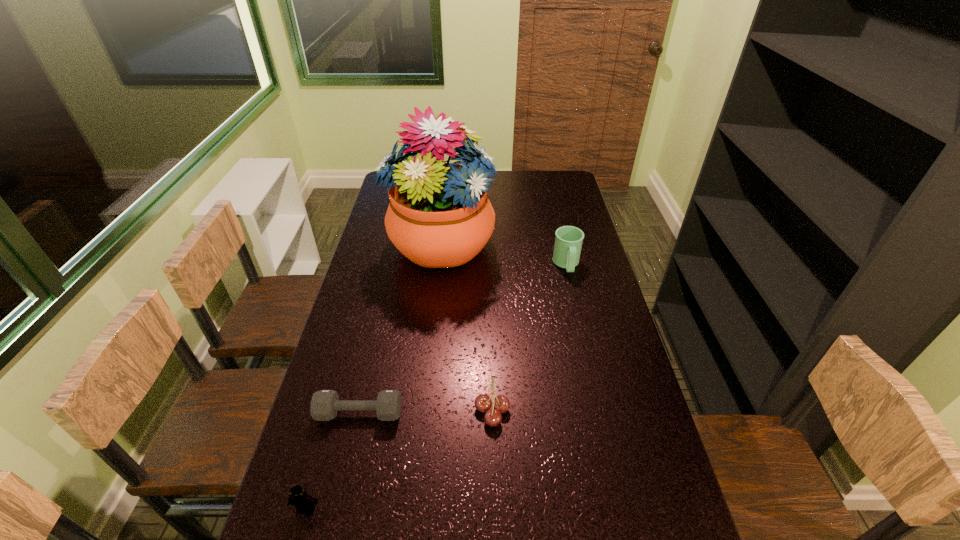
Where is `the tallest object`? The height and width of the screenshot is (540, 960). the tallest object is located at coordinates (439, 215).

The width and height of the screenshot is (960, 540). Find the location of `mug`. mug is located at coordinates (568, 241).

In order to click on the second tallest object in this screenshot , I will do `click(568, 241)`.

The height and width of the screenshot is (540, 960). Identify the location of Lego. [301, 500].

Locate an element on the screen. cherry is located at coordinates (483, 403).

The width and height of the screenshot is (960, 540). In order to click on the shortest object in this screenshot , I will do `click(325, 404)`.

Locate an element on the screen. vacant point located 0.290m on the front of the tallest object is located at coordinates (429, 349).

What are the coordinates of `free spot located on the side of the mug with the handle` in the screenshot? It's located at (572, 291).

At what (x,y) coordinates should I click in order to perform the action: click on free location located on the leaves of the cherry. Please return your answer as a coordinate pair (x, y). The height and width of the screenshot is (540, 960). Looking at the image, I should click on [420, 410].

The image size is (960, 540). I want to click on vacant space located 0.290m on the leaves of the cherry, so click(363, 410).